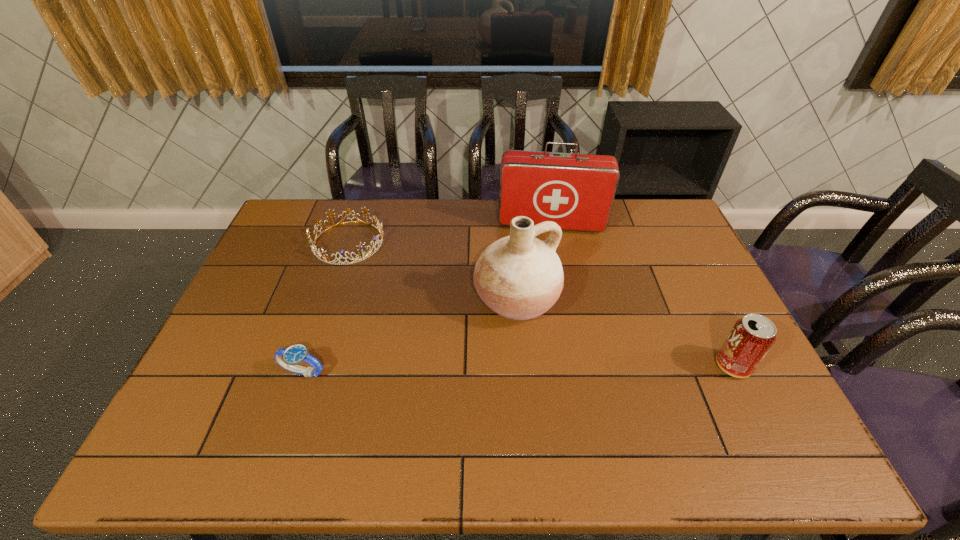
Where is `object at the right edge`? Image resolution: width=960 pixels, height=540 pixels. object at the right edge is located at coordinates (752, 336).

I want to click on object that is at the far left corner, so click(x=321, y=252).

Identify the location of vacant space at the far edge. Image resolution: width=960 pixels, height=540 pixels. (610, 225).

You are a GUI agent. You are given a task and a screenshot of the screen. Output one action in this format:
    pyautogui.click(x=<x>, y=<y>)
    Task: Click on the blank space at the near edge
    Image resolution: width=960 pixels, height=540 pixels.
    Given the screenshot: What is the action you would take?
    pyautogui.click(x=305, y=390)

Locate an element on the screen. This screenshot has width=960, height=540. vacant region at the left edge of the desktop is located at coordinates (235, 336).

I want to click on free space at the right edge of the desktop, so click(x=756, y=376).

Locate an element on the screen. The width and height of the screenshot is (960, 540). free space at the far left corner of the desktop is located at coordinates (292, 208).

This screenshot has width=960, height=540. In order to click on blank space at the far right corner in this screenshot , I will do `click(663, 234)`.

Where is `free space between the watch and the rightmost object`? The image size is (960, 540). free space between the watch and the rightmost object is located at coordinates (517, 369).

I want to click on free point between the watch and the tiara, so click(x=325, y=307).